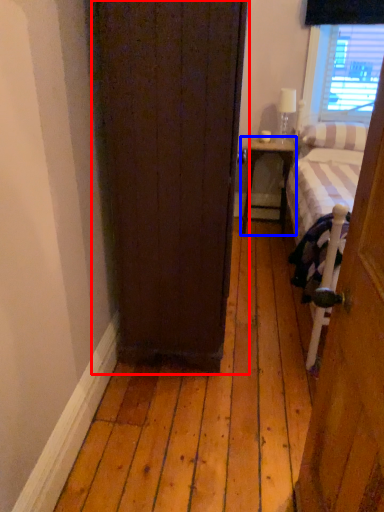
Question: Which object appears closest to the camera in this image, door (highlighted by a red box) or nightstand (highlighted by a blue box)?

Choices:
 (A) door
 (B) nightstand

Answer: (A)